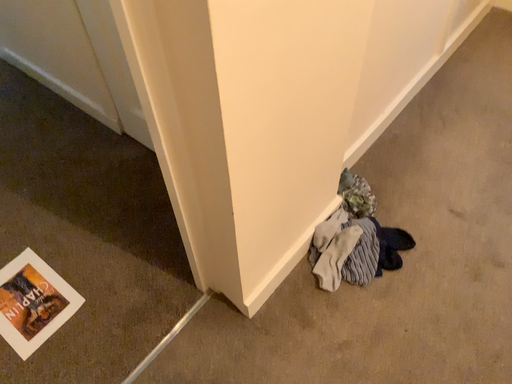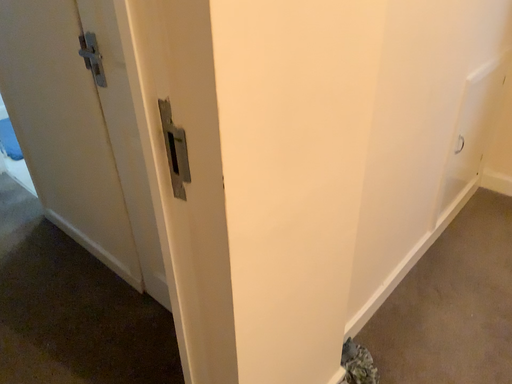
Question: How did the camera likely rotate when shooting the video?

Choices:
 (A) rotated downward
 (B) rotated upward

Answer: (B)